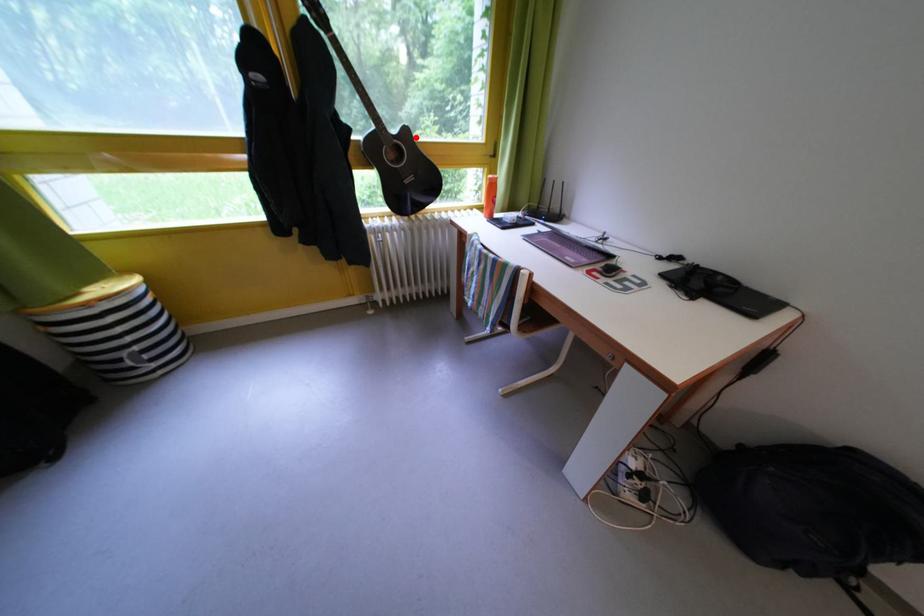
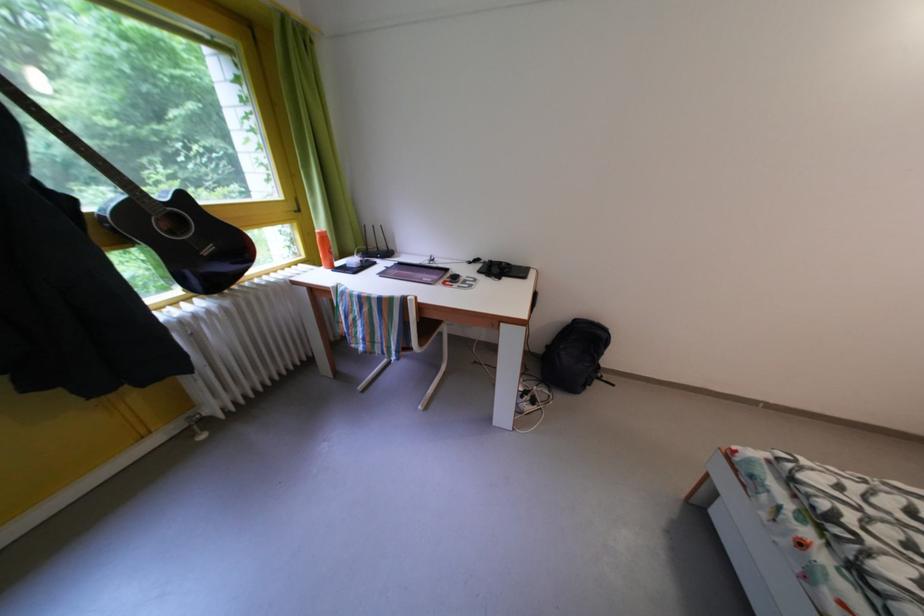
Question: I am providing you with two images of the same scene from different viewpoints. Given a red point in image1, look at the same physical point in image2. Is it:

Choices:
 (A) Closer to the viewpoint
 (B) Farther from the viewpoint

Answer: (B)